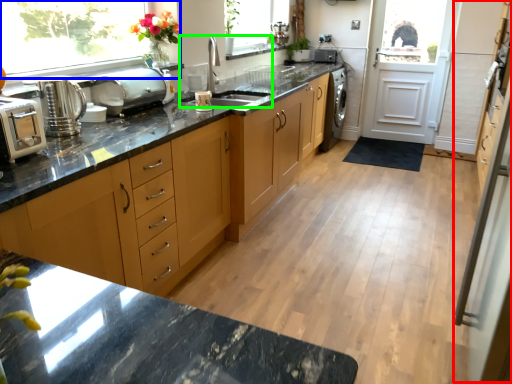
Question: Based on their relative distances, which object is farther from screen door (highlighted by a red box)? Choose from window (highlighted by a blue box) and sink (highlighted by a green box).

Choices:
 (A) window
 (B) sink

Answer: (A)